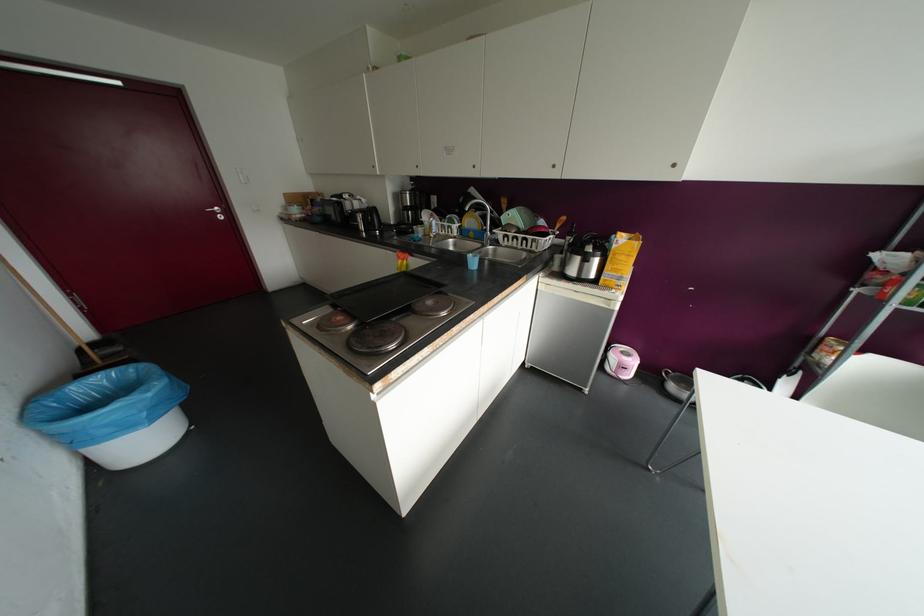
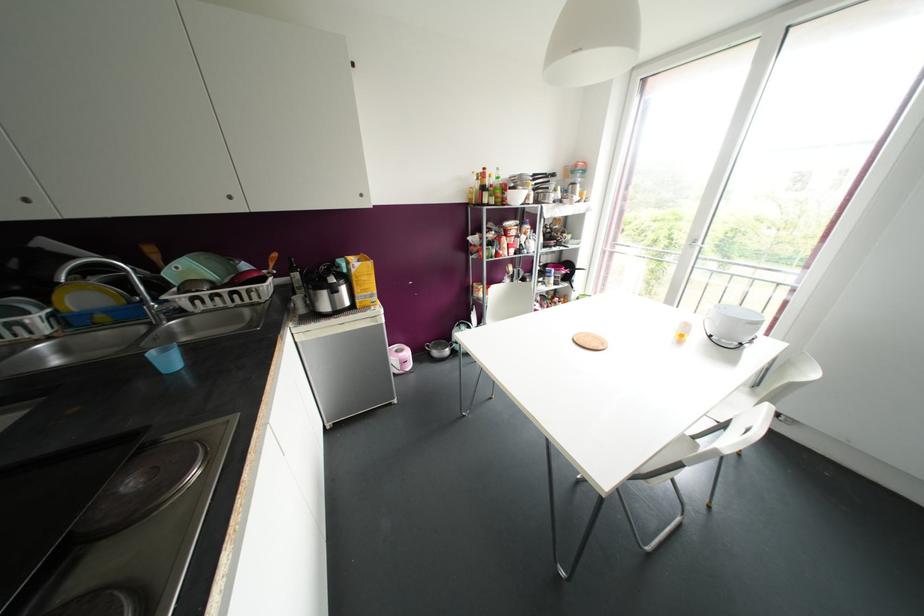
Where in the second image is the point corresponding to (x=494, y=241) from the first image?

(178, 312)